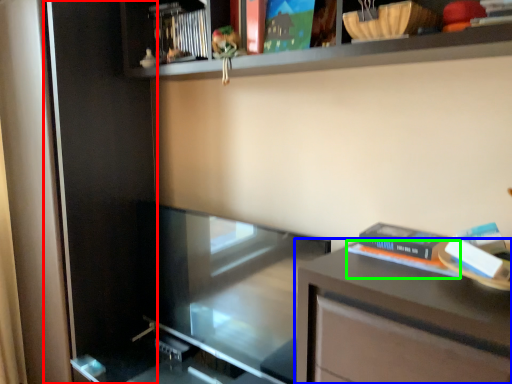
Question: Which is farther away from screen door (highlighted by a red box)? table (highlighted by a blue box) or paperback book (highlighted by a green box)?

Choices:
 (A) table
 (B) paperback book

Answer: (A)